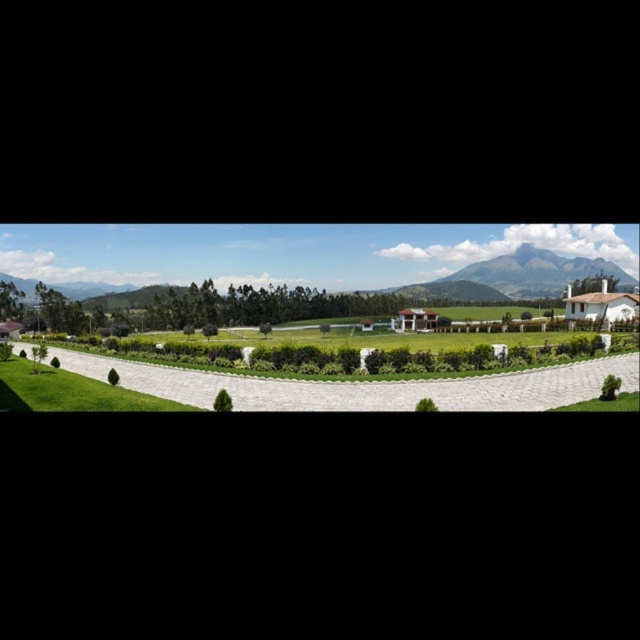
Can you confirm if rugged stone mountain at upper center is thinner than rugged brown mountain at center?

No, rugged stone mountain at upper center is not thinner than rugged brown mountain at center.

Does rugged stone mountain at upper center appear on the left side of rugged brown mountain at center?

Yes, rugged stone mountain at upper center is to the left of rugged brown mountain at center.

At what (x,y) coordinates should I click in order to perform the action: click on rugged stone mountain at upper center. Please return your answer as a coordinate pair (x, y). This screenshot has width=640, height=640. Looking at the image, I should click on (320, 259).

Which is below, rugged stone mountain at upper center or green grass at center?

green grass at center is lower down.

Is rugged stone mountain at upper center positioned at the back of green grass at center?

Yes, rugged stone mountain at upper center is further from the viewer.

At what (x,y) coordinates should I click in order to perform the action: click on rugged stone mountain at upper center. Please return your answer as a coordinate pair (x, y). Looking at the image, I should click on (320, 259).

Which is more to the right, green grass at center or rugged brown mountain at center?

rugged brown mountain at center

Can you confirm if green grass at center is bigger than rugged brown mountain at center?

No, green grass at center is not bigger than rugged brown mountain at center.

Who is more distant from viewer, (x=492, y=371) or (x=502, y=285)?

The point (x=502, y=285) is more distant.

This screenshot has height=640, width=640. I want to click on green grass at center, so click(358, 356).